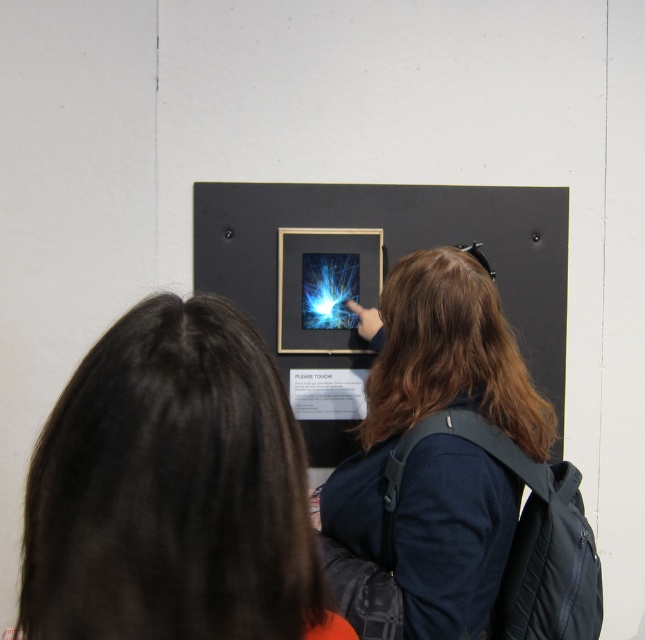
Question: Can you confirm if dark brown hair at center is positioned to the right of matte black backpack at center?

Choices:
 (A) no
 (B) yes

Answer: (A)

Question: Is the position of dark brown hair at center less distant than that of matte black backpack at center?

Choices:
 (A) no
 (B) yes

Answer: (B)

Question: Which point is farther from the camera taking this photo?

Choices:
 (A) (368, 506)
 (B) (37, 435)

Answer: (A)

Question: Is dark brown hair at center to the right of matte black backpack at center from the viewer's perspective?

Choices:
 (A) no
 (B) yes

Answer: (A)

Question: Which object is closer to the camera taking this photo?

Choices:
 (A) matte black backpack at center
 (B) dark brown hair at center

Answer: (B)